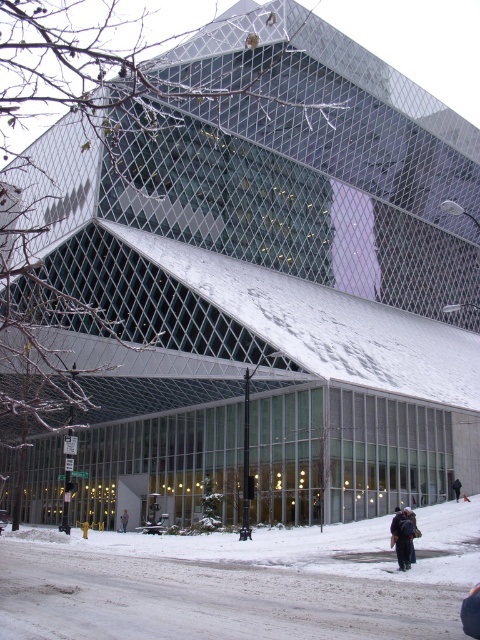
You are standing in front of the modern architectural structure and see a dark gray backpack at lower right and a dark gray jacket at lower right. Which one is more to the left?

The dark gray backpack at lower right is more to the left than the dark gray jacket at lower right.

You are standing in front of the modern building and see a dark gray backpack at lower right and a light gray knit sweater at lower center. Which object is taller?

The dark gray backpack at lower right is taller than the light gray knit sweater at lower center.